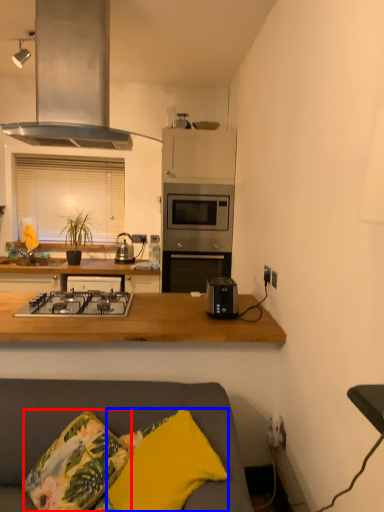
Question: Among these objects, which one is nearest to the camera, throw pillow (highlighted by a red box) or pillow (highlighted by a blue box)?

Choices:
 (A) throw pillow
 (B) pillow

Answer: (B)